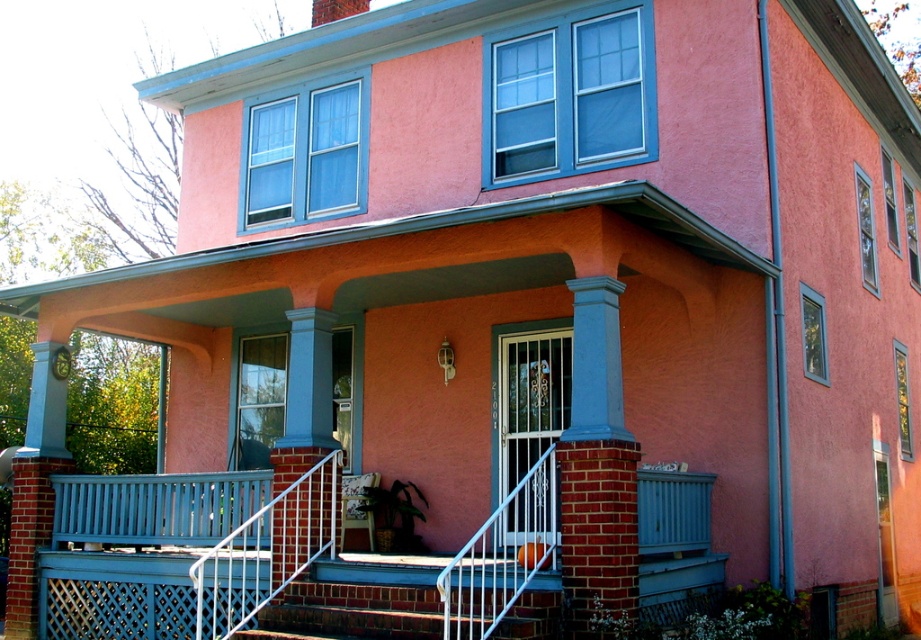
You are a painter hired to paint the blue painted brick column at center and the white metal railing at lower center. You have a ladder that can reach up to 2 meters. Can you paint both objects without needing a taller ladder?

The blue painted brick column at center is much taller than the white metal railing at lower center. Since the ladder can only reach up to 2 meters, you may need a taller ladder to paint the entire height of the blue painted brick column at center if it exceeds 2 meters in height.

You are standing at the bottom of the steps leading to the pink house. You want to place a small potted plant exactly at the point marked by the coordinates point (596, 467). Based on the scene description, where would this point be located?

The point (596, 467) marks the location of the blue painted brick column at center, so you should place the potted plant there.